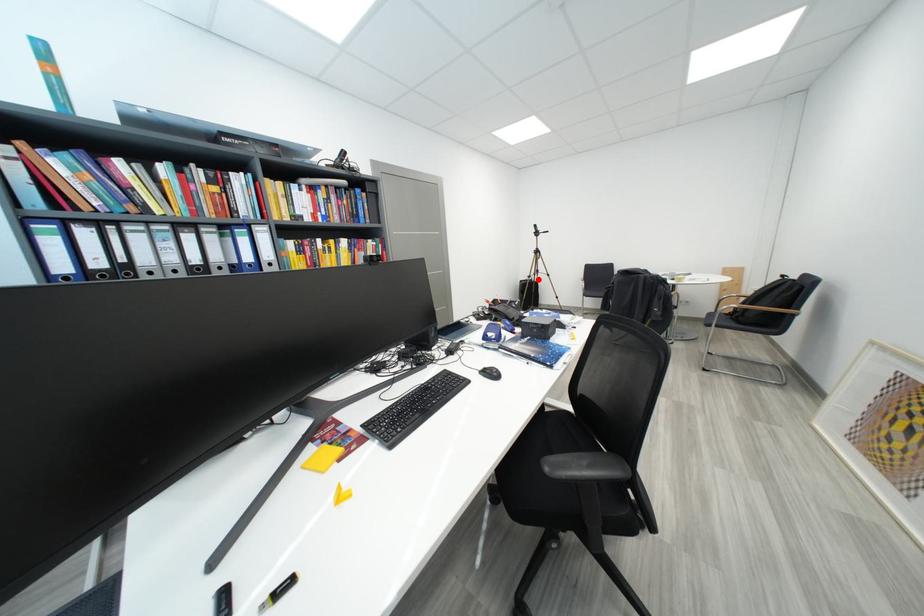
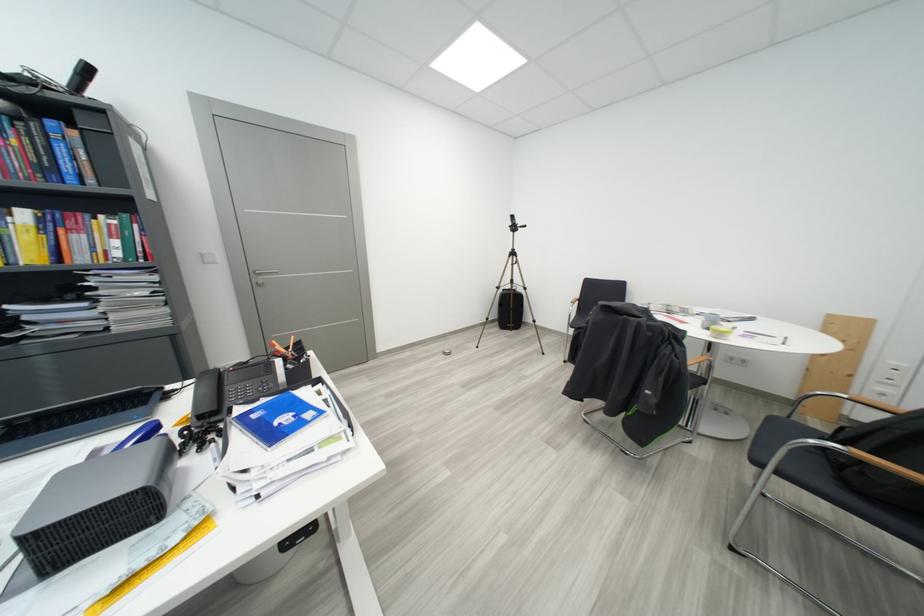
Question: I am providing you with two images of the same scene from different viewpoints. In image1, a red point is highlighted. Considering the same 3D point in image2, which of the following is correct?

Choices:
 (A) It is closer
 (B) It is farther

Answer: (B)